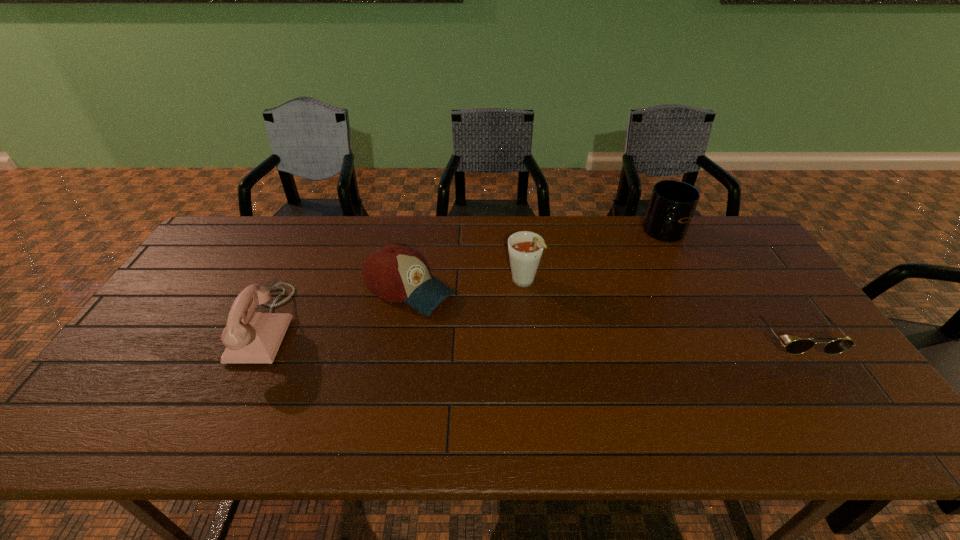
Identify the location of vacant area situated 0.110m on the drink side of the tallest object. (545, 324).

You are a GUI agent. You are given a task and a screenshot of the screen. Output one action in this format:
    pyautogui.click(x=<x>, y=<y>)
    Task: Click on the vacant space situated 0.270m on the drink side of the tallest object
    The height and width of the screenshot is (540, 960).
    Given the screenshot: What is the action you would take?
    pyautogui.click(x=572, y=370)

This screenshot has height=540, width=960. Identify the location of object that is at the far edge. (672, 205).

I want to click on object that is positioned at the right edge, so click(799, 346).

Find the location of a particular element. free space at the far edge is located at coordinates (414, 229).

The width and height of the screenshot is (960, 540). In the image, there is a desktop. In order to click on vacant space at the near edge in this screenshot , I will do `click(218, 388)`.

What are the coordinates of `vacant space at the left edge` in the screenshot? It's located at (180, 357).

At what (x,y) coordinates should I click in order to perform the action: click on vacant area at the far left corner. Please return your answer as a coordinate pair (x, y). Image resolution: width=960 pixels, height=540 pixels. Looking at the image, I should click on (238, 255).

Find the location of a particular element. This screenshot has width=960, height=540. vacant space at the far right corner is located at coordinates (712, 220).

Where is `free space between the rightmost object and the telephone`? This screenshot has height=540, width=960. free space between the rightmost object and the telephone is located at coordinates (529, 332).